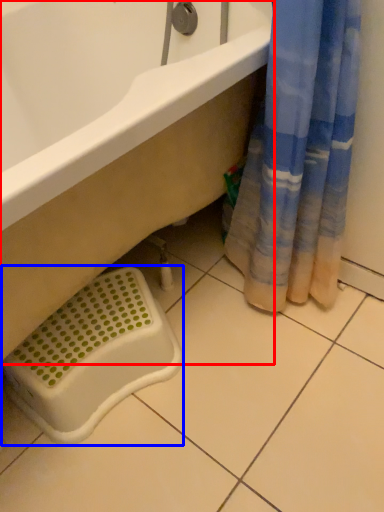
Question: Among these objects, which one is farthest to the camera, bathtub (highlighted by a red box) or laundry basket (highlighted by a blue box)?

Choices:
 (A) bathtub
 (B) laundry basket

Answer: (B)